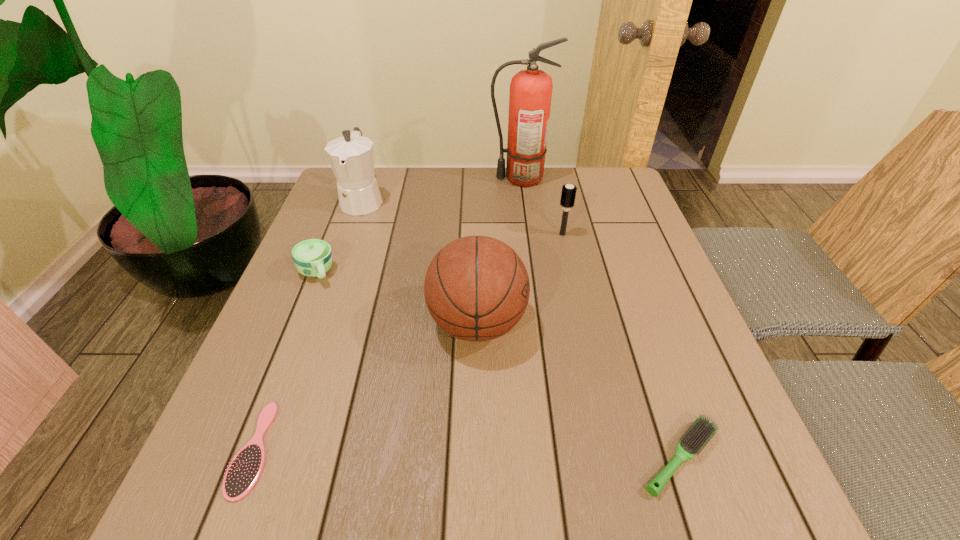
At what (x,y) coordinates should I click in order to perform the action: click on free spot between the fire extinguisher and the coffeepot. Please return your answer as a coordinate pair (x, y). The height and width of the screenshot is (540, 960). Looking at the image, I should click on (442, 189).

Identify the location of free space that is in between the third nearest object and the shortest hairbrush. Image resolution: width=960 pixels, height=540 pixels. pos(366,386).

Where is `vacant area that lies between the third shortest object and the basketball`? The image size is (960, 540). vacant area that lies between the third shortest object and the basketball is located at coordinates (396, 298).

You are a GUI agent. You are given a task and a screenshot of the screen. Output one action in this format:
    pyautogui.click(x=<x>, y=<y>)
    Task: Click on the vacant area between the shortest object and the second hairbrush from left to right
    
    Given the screenshot: What is the action you would take?
    pyautogui.click(x=408, y=341)

The width and height of the screenshot is (960, 540). I want to click on object identified as the closest to the third farthest object, so click(530, 96).

The height and width of the screenshot is (540, 960). Identify the location of object identified as the fifth closest to the coffeepot. (245, 469).

Identify which hairbrush is the closest to the second shortest object. Please provide its 2D coordinates. Your answer should be formatted as a tuple, i.e. [(x, y)], where the tuple contains the x and y coordinates of a point satisfying the conditions above.

[(568, 193)]

You are a GUI agent. You are given a task and a screenshot of the screen. Output one action in this format:
    pyautogui.click(x=<x>, y=<y>)
    Task: Click on the hairbrush that stands as the second closest to the cup
    This screenshot has width=960, height=540.
    Given the screenshot: What is the action you would take?
    pyautogui.click(x=568, y=193)

Image resolution: width=960 pixels, height=540 pixels. I want to click on free location that satisfies the following two spatial constraints: 1. on the nozzle of the fire extinguisher; 2. at the spout of the coffeepot, so click(x=523, y=200).

Where is `vacant space that satisfies the following two spatial constraints: 1. on the nozzle of the tallest object; 2. on the back side of the tallest hairbrush`? vacant space that satisfies the following two spatial constraints: 1. on the nozzle of the tallest object; 2. on the back side of the tallest hairbrush is located at coordinates (527, 234).